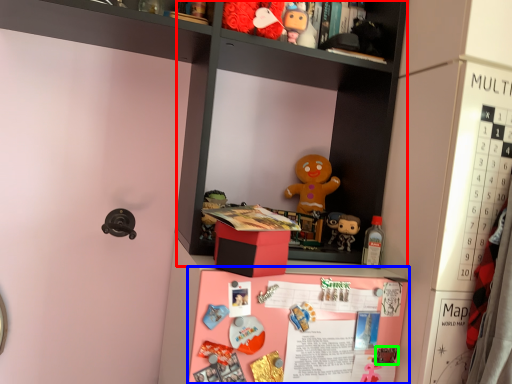
Question: Considering the real-world distances, which object is closest to cabinet (highlighted by a red box)? table (highlighted by a blue box) or toy (highlighted by a green box).

Choices:
 (A) table
 (B) toy

Answer: (A)